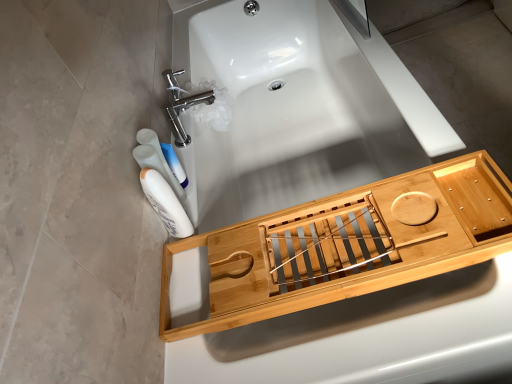
Question: Is white glossy mouthwash at left, which is the 1th mouthwash from front to back, thinner than polished chrome faucet at upper left?

Choices:
 (A) yes
 (B) no

Answer: (A)

Question: From a real-world perspective, does white glossy mouthwash at left, the second mouthwash when ordered from back to front, stand above polished chrome faucet at upper left?

Choices:
 (A) no
 (B) yes

Answer: (B)

Question: Is white glossy mouthwash at left, the second mouthwash when ordered from back to front, far away from polished chrome faucet at upper left?

Choices:
 (A) no
 (B) yes

Answer: (A)

Question: Considering the relative sizes of white glossy mouthwash at left, which is the 1th mouthwash from front to back, and polished chrome faucet at upper left in the image provided, is white glossy mouthwash at left, which is the 1th mouthwash from front to back, smaller than polished chrome faucet at upper left?

Choices:
 (A) yes
 (B) no

Answer: (A)

Question: Is white glossy mouthwash at left, which is the 1th mouthwash from front to back, to the right of polished chrome faucet at upper left from the viewer's perspective?

Choices:
 (A) yes
 (B) no

Answer: (A)

Question: From the image's perspective, is white glossy mouthwash at left, the second mouthwash when ordered from back to front, on polished chrome faucet at upper left?

Choices:
 (A) no
 (B) yes

Answer: (A)

Question: Is natural wood bath tray at center wider than polished chrome faucet at upper left?

Choices:
 (A) no
 (B) yes

Answer: (B)

Question: Can you confirm if natural wood bath tray at center is smaller than polished chrome faucet at upper left?

Choices:
 (A) no
 (B) yes

Answer: (A)

Question: Does natural wood bath tray at center appear on the left side of polished chrome faucet at upper left?

Choices:
 (A) yes
 (B) no

Answer: (B)

Question: Is natural wood bath tray at center with polished chrome faucet at upper left?

Choices:
 (A) yes
 (B) no

Answer: (B)

Question: Does natural wood bath tray at center have a larger size compared to polished chrome faucet at upper left?

Choices:
 (A) yes
 (B) no

Answer: (A)

Question: Does natural wood bath tray at center have a greater height compared to polished chrome faucet at upper left?

Choices:
 (A) no
 (B) yes

Answer: (B)

Question: From a real-world perspective, is polished chrome faucet at upper left located higher than white glossy bottle at lower left, the 1th mouthwash positioned from the back?

Choices:
 (A) no
 (B) yes

Answer: (A)